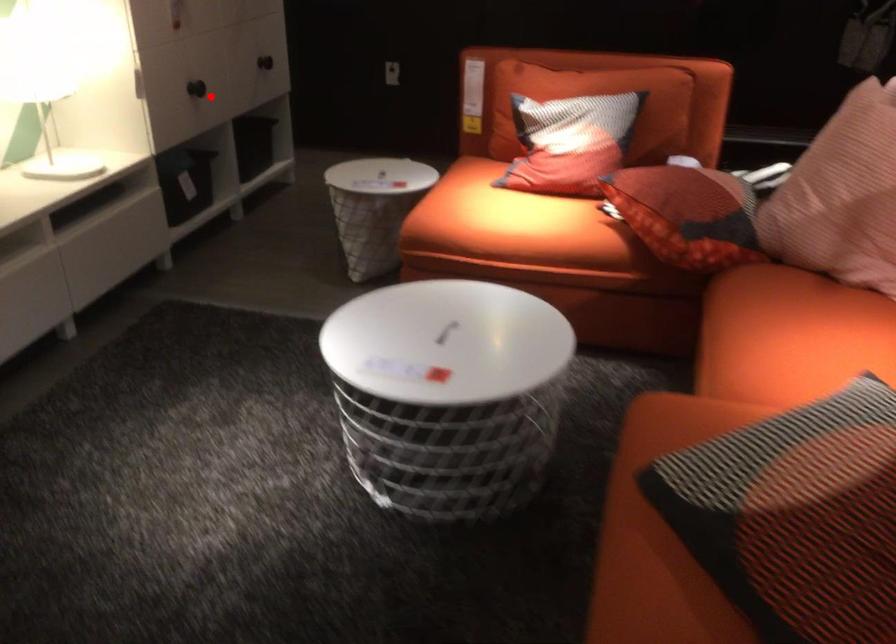
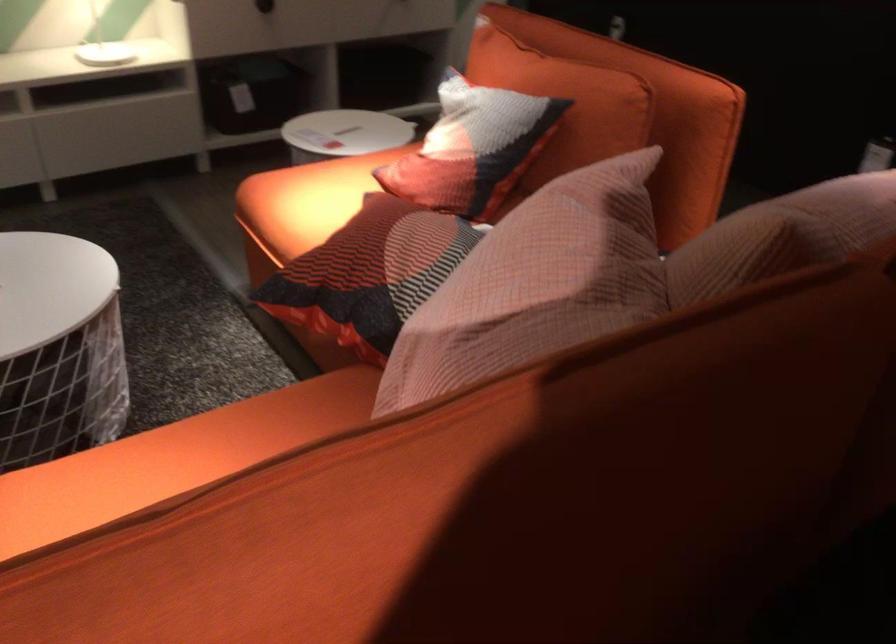
In the second image, find the point that corresponds to the highlighted location in the first image.

(264, 6)